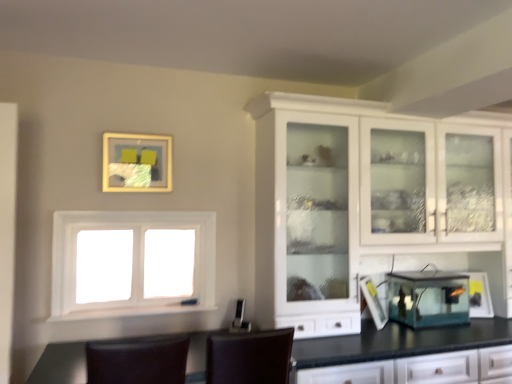
Question: From the image's perspective, is brown leather chair at lower center, the 2th chair when ordered from right to left, below transparent glass lantern at lower right, which ranks as the second appliance in left-to-right order?

Choices:
 (A) no
 (B) yes

Answer: (B)

Question: Is brown leather chair at lower center, the first chair from the left, taller than transparent glass lantern at lower right, which ranks as the second appliance in left-to-right order?

Choices:
 (A) no
 (B) yes

Answer: (B)

Question: Does brown leather chair at lower center, the first chair from the left, have a lesser width compared to transparent glass lantern at lower right, which ranks as the second appliance in left-to-right order?

Choices:
 (A) no
 (B) yes

Answer: (A)

Question: Is brown leather chair at lower center, the 2th chair when ordered from right to left, at the left side of transparent glass lantern at lower right, the first appliance in the right-to-left sequence?

Choices:
 (A) yes
 (B) no

Answer: (A)

Question: From the image's perspective, is brown leather chair at lower center, the 2th chair when ordered from right to left, above transparent glass lantern at lower right, which ranks as the second appliance in left-to-right order?

Choices:
 (A) no
 (B) yes

Answer: (A)

Question: Considering the relative positions of transparent glass lantern at lower right, which ranks as the second appliance in left-to-right order, and matte gold picture frame at upper center in the image provided, is transparent glass lantern at lower right, which ranks as the second appliance in left-to-right order, to the left or to the right of matte gold picture frame at upper center?

Choices:
 (A) left
 (B) right

Answer: (B)

Question: Is transparent glass lantern at lower right, the first appliance in the right-to-left sequence, spatially inside matte gold picture frame at upper center, or outside of it?

Choices:
 (A) inside
 (B) outside

Answer: (B)

Question: Relative to matte gold picture frame at upper center, is transparent glass lantern at lower right, the first appliance in the right-to-left sequence, in front or behind?

Choices:
 (A) front
 (B) behind

Answer: (B)

Question: Considering the positions of transparent glass lantern at lower right, the first appliance in the right-to-left sequence, and matte gold picture frame at upper center in the image, is transparent glass lantern at lower right, the first appliance in the right-to-left sequence, wider or thinner than matte gold picture frame at upper center?

Choices:
 (A) thin
 (B) wide

Answer: (B)

Question: Is brown leather chair at lower center, the first chair from the left, spatially inside transparent glass lantern at lower right, the first appliance in the right-to-left sequence, or outside of it?

Choices:
 (A) outside
 (B) inside

Answer: (A)

Question: Visually, is brown leather chair at lower center, the 2th chair when ordered from right to left, positioned to the left or to the right of transparent glass lantern at lower right, which ranks as the second appliance in left-to-right order?

Choices:
 (A) left
 (B) right

Answer: (A)

Question: From their relative heights in the image, would you say brown leather chair at lower center, the first chair from the left, is taller or shorter than transparent glass lantern at lower right, which ranks as the second appliance in left-to-right order?

Choices:
 (A) short
 (B) tall

Answer: (B)

Question: Is point (121, 365) closer or farther from the camera than point (474, 286)?

Choices:
 (A) closer
 (B) farther

Answer: (A)

Question: From the image's perspective, relative to brown leather chair at lower center, the first chair from the left, is transparent glass lantern at lower right, the first appliance in the right-to-left sequence, above or below?

Choices:
 (A) above
 (B) below

Answer: (A)

Question: Considering the positions of transparent glass lantern at lower right, which ranks as the second appliance in left-to-right order, and brown leather chair at lower center, the 2th chair when ordered from right to left, in the image, is transparent glass lantern at lower right, which ranks as the second appliance in left-to-right order, taller or shorter than brown leather chair at lower center, the 2th chair when ordered from right to left,?

Choices:
 (A) short
 (B) tall

Answer: (A)